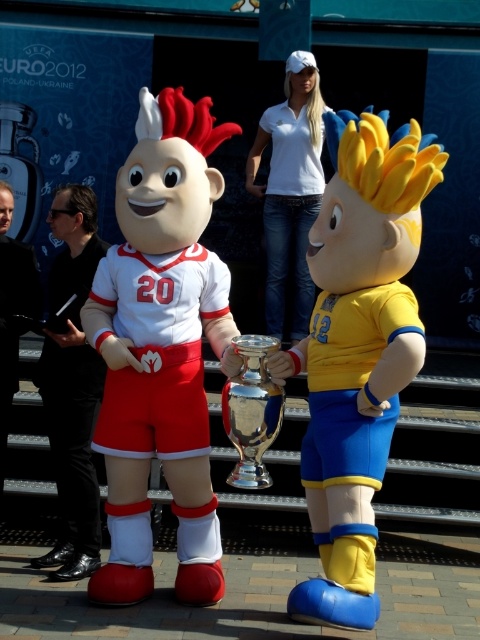
You are a photographer preparing to take a photo of the black shiny suit at left and the white cotton shirt at upper center. Based on their sizes, which one should you focus on first to ensure both are in frame?

The black shiny suit at left has a smaller size compared to white cotton shirt at upper center, so you should focus on the white cotton shirt at upper center first to ensure both are in frame.